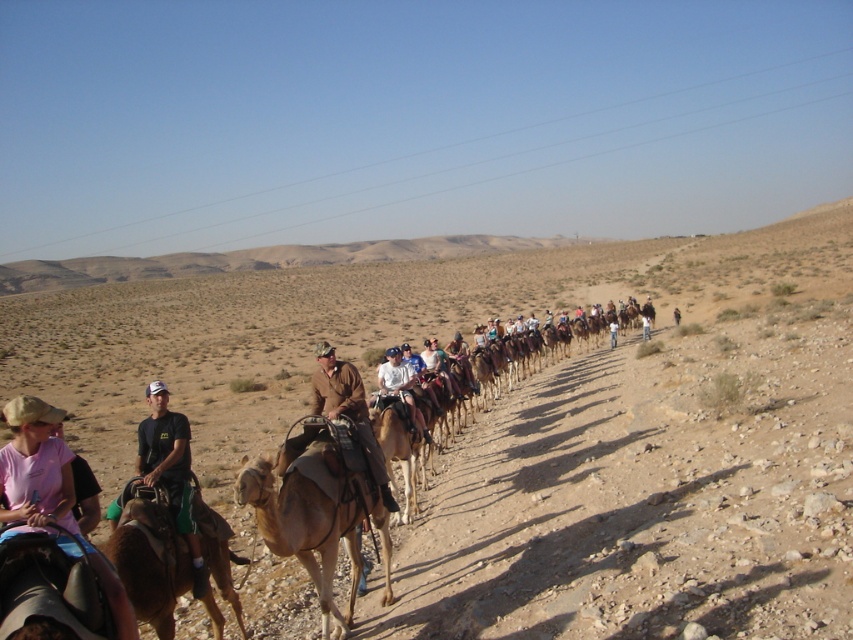
A photographer wants to capture a closeup of the pink fabric cap at lower left without including any other objects in the frame. Given the camera has a 50mm focal length and the cap is 10 meters away, what is the minimum distance the photographer should move forward to ensure only the cap is in the shot?

The photographer should move forward until the distance to the pink fabric cap at lower left is less than 10 meters, ensuring the camera frame captures only the cap.

You are standing in the desert scene and want to place a small flag at the point that is closer to you. Which point should you choose between point (335, 376) and point (399, 365)?

You should choose point (335, 376) because it is closer to the viewer than point (399, 365).